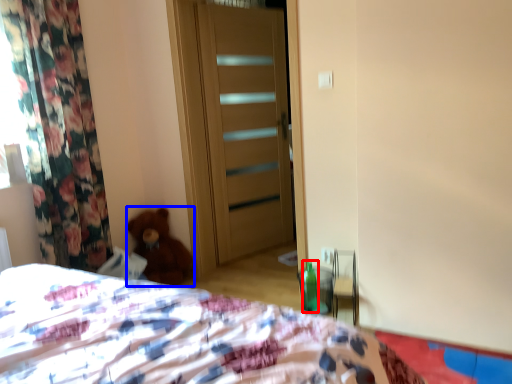
Question: Among these objects, which one is farthest to the camera, bottle (highlighted by a red box) or teddy bear (highlighted by a blue box)?

Choices:
 (A) bottle
 (B) teddy bear

Answer: (B)